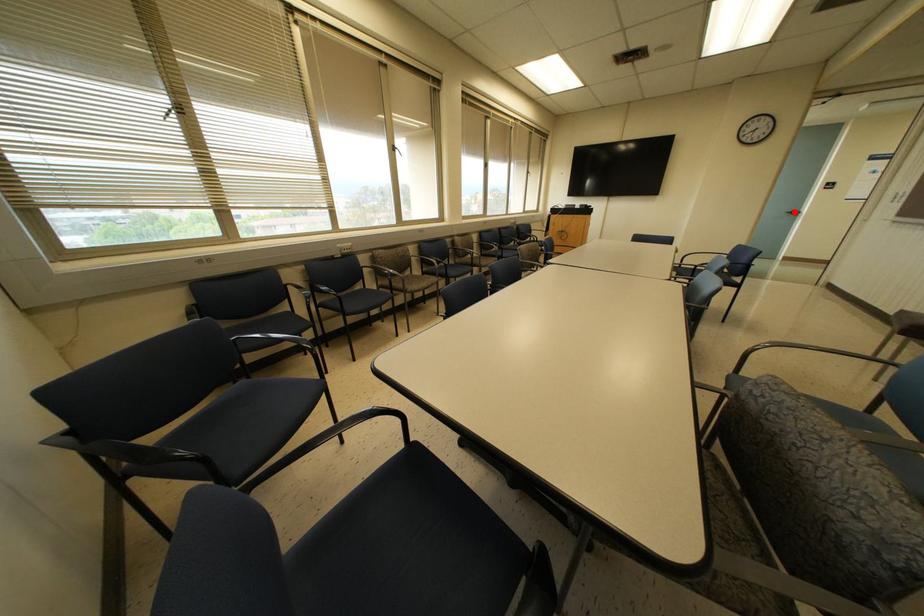
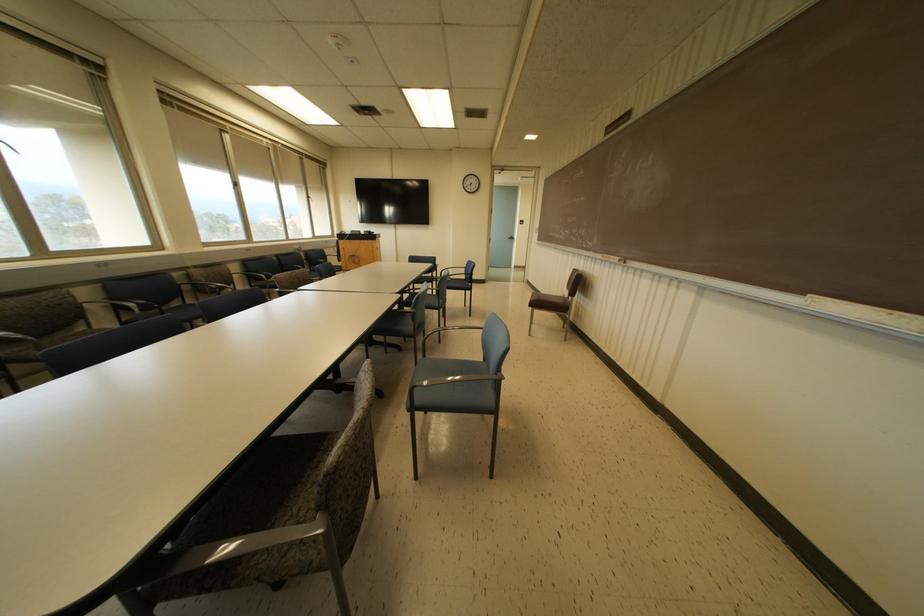
Question: I am providing you with two images of the same scene from different viewpoints. In image1, a red point is highlighted. Considering the same 3D point in image2, which of the following is correct?

Choices:
 (A) It is closer
 (B) It is farther

Answer: (A)